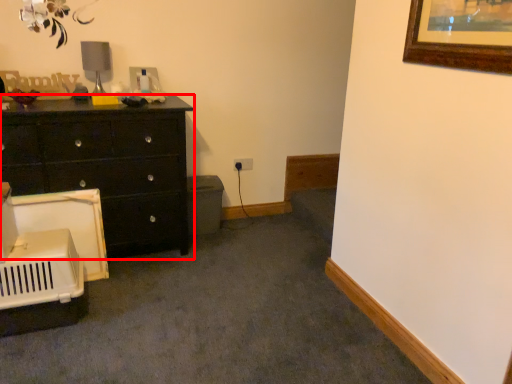
Question: From the image's perspective, what is the correct spatial relationship of chest of drawers (annotated by the red box) in relation to table lamp?

Choices:
 (A) above
 (B) below

Answer: (B)